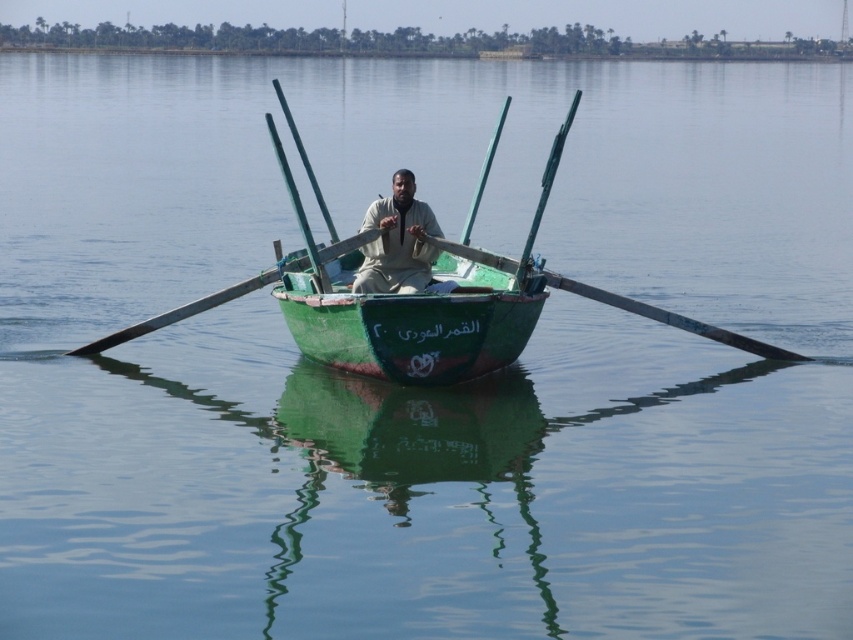
Question: Which object is closer to the camera taking this photo?

Choices:
 (A) green matte boat at center
 (B) green wood paddle at center

Answer: (B)

Question: Considering the real-world distances, which object is closest to the green wooden paddle at center?

Choices:
 (A) green matte canoe at center
 (B) green wood paddle at center
 (C) green matte boat at center
 (D) light brown fabric shirt at center

Answer: (D)

Question: Can you confirm if green matte canoe at center is positioned to the left of green wood paddle at center?

Choices:
 (A) no
 (B) yes

Answer: (B)

Question: Observing the image, what is the correct spatial positioning of green matte boat at center in reference to green wood paddle at center?

Choices:
 (A) above
 (B) below

Answer: (A)

Question: Which point is farther to the camera?

Choices:
 (A) (508, 340)
 (B) (424, 264)
 (C) (793, 356)

Answer: (C)

Question: Is green matte boat at center thinner than light brown fabric shirt at center?

Choices:
 (A) yes
 (B) no

Answer: (A)